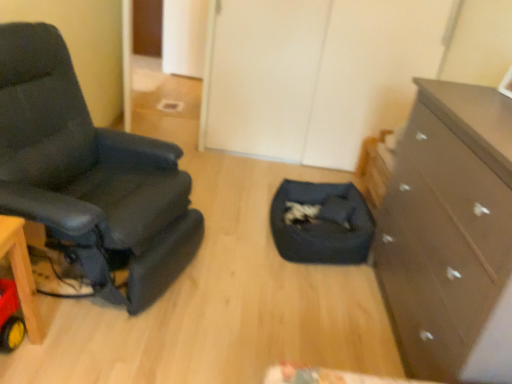
Question: From the image's perspective, relative to black leather chair at left, is dark brown wooden chest of drawers at right above or below?

Choices:
 (A) above
 (B) below

Answer: (B)

Question: Is dark brown wooden chest of drawers at right in front of or behind black leather chair at left in the image?

Choices:
 (A) behind
 (B) front

Answer: (B)

Question: Estimate the real-world distances between objects in this image. Which object is closer to the black leather chair at left?

Choices:
 (A) dark blue fabric pet bed at center
 (B) dark brown wooden chest of drawers at right

Answer: (A)

Question: Estimate the real-world distances between objects in this image. Which object is closer to the dark blue fabric pet bed at center?

Choices:
 (A) black leather chair at left
 (B) dark brown wooden chest of drawers at right

Answer: (B)